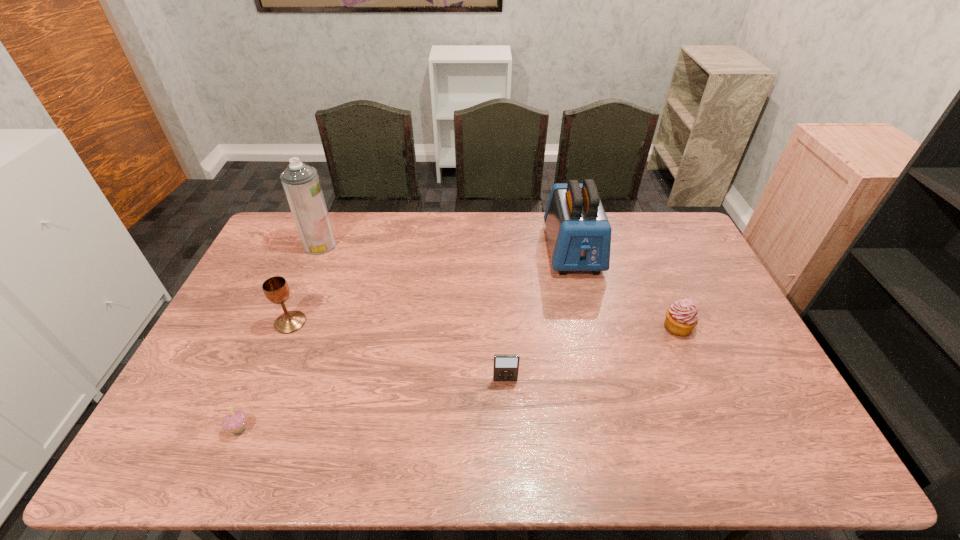
Where is `chalice that is positioned at the left edge`? chalice that is positioned at the left edge is located at coordinates (276, 289).

Find the location of `cupcake at the left edge`. cupcake at the left edge is located at coordinates (235, 422).

The image size is (960, 540). Identify the location of object present at the right edge. (681, 317).

Locate an element on the screen. object located at the far left corner is located at coordinates (301, 183).

What are the coordinates of `object present at the near left corner` in the screenshot? It's located at (235, 422).

The image size is (960, 540). I want to click on vacant space at the far edge of the desktop, so pyautogui.click(x=437, y=220).

This screenshot has width=960, height=540. In the image, there is a desktop. Find the location of `vacant space at the near edge`. vacant space at the near edge is located at coordinates click(x=643, y=441).

Where is `vacant space at the left edge of the desktop`? vacant space at the left edge of the desktop is located at coordinates (220, 367).

In the image, there is a desktop. Where is `blank space at the right edge`? The image size is (960, 540). blank space at the right edge is located at coordinates (692, 339).

Find the location of a particular element. This screenshot has width=960, height=540. vacant point at the far left corner is located at coordinates (267, 242).